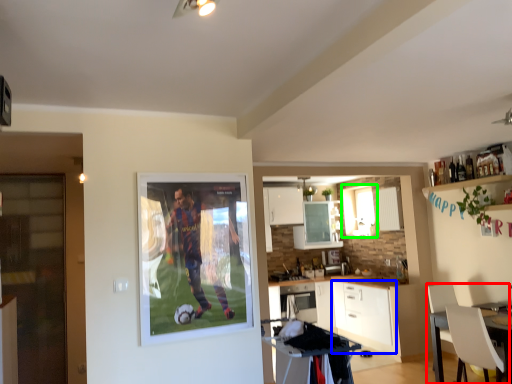
Question: Based on their relative distances, which object is farther from chair (highlighted by a red box)? Choose from cabinetry (highlighted by a blue box) and window (highlighted by a green box).

Choices:
 (A) cabinetry
 (B) window

Answer: (B)